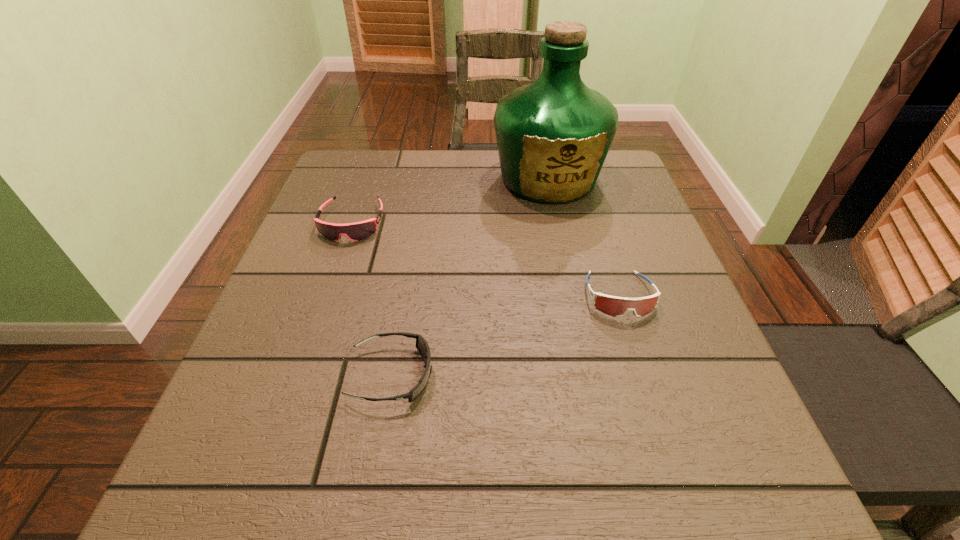
At what (x,y) coordinates should I click in order to perform the action: click on vacant space at the far left corner. Please return your answer as a coordinate pair (x, y). Image resolution: width=960 pixels, height=540 pixels. Looking at the image, I should click on coord(373,171).

What are the coordinates of `vacant point at the near left corner` in the screenshot? It's located at (243, 522).

Find the location of a particular element. This screenshot has width=960, height=540. vacant space at the near right corner of the desktop is located at coordinates [727, 521].

This screenshot has height=540, width=960. Find the location of `vacant space in between the tallest object and the leftmost goggles`. vacant space in between the tallest object and the leftmost goggles is located at coordinates (450, 201).

Locate an element on the screen. Image resolution: width=960 pixels, height=540 pixels. free space that is in between the leftmost object and the second nearest goggles is located at coordinates (486, 259).

This screenshot has height=540, width=960. Identify the location of blank region between the rightmost goggles and the leftmost goggles. (486, 259).

Image resolution: width=960 pixels, height=540 pixels. Find the location of `free space between the leftmost goggles and the second nearest object`. free space between the leftmost goggles and the second nearest object is located at coordinates (486, 259).

Where is `blank region between the second farthest goggles and the second object from left to right`? The width and height of the screenshot is (960, 540). blank region between the second farthest goggles and the second object from left to right is located at coordinates (505, 335).

The height and width of the screenshot is (540, 960). I want to click on unoccupied position between the leftmost goggles and the second goggles from right to left, so click(x=372, y=299).

This screenshot has height=540, width=960. I want to click on empty location between the rightmost goggles and the liquor, so click(584, 237).